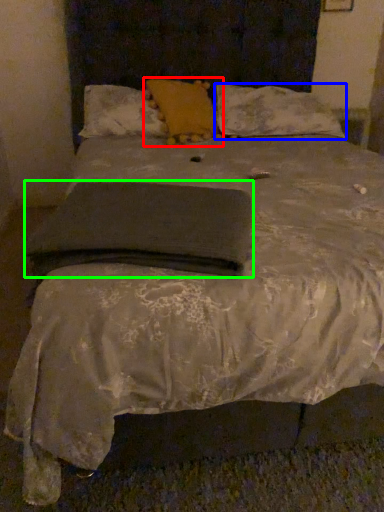
Question: Which is farther away from pillow (highlighted by a red box)? pillow (highlighted by a blue box) or pad (highlighted by a green box)?

Choices:
 (A) pillow
 (B) pad

Answer: (B)